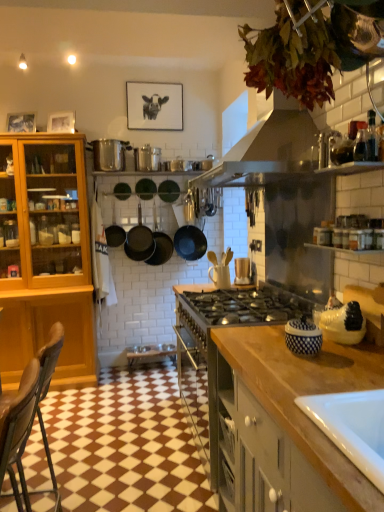
The width and height of the screenshot is (384, 512). In order to click on vacant space to the right of blue and white ceramic jar at right, which appears as the 5th appliance when viewed from the back in this screenshot , I will do pyautogui.click(x=350, y=345).